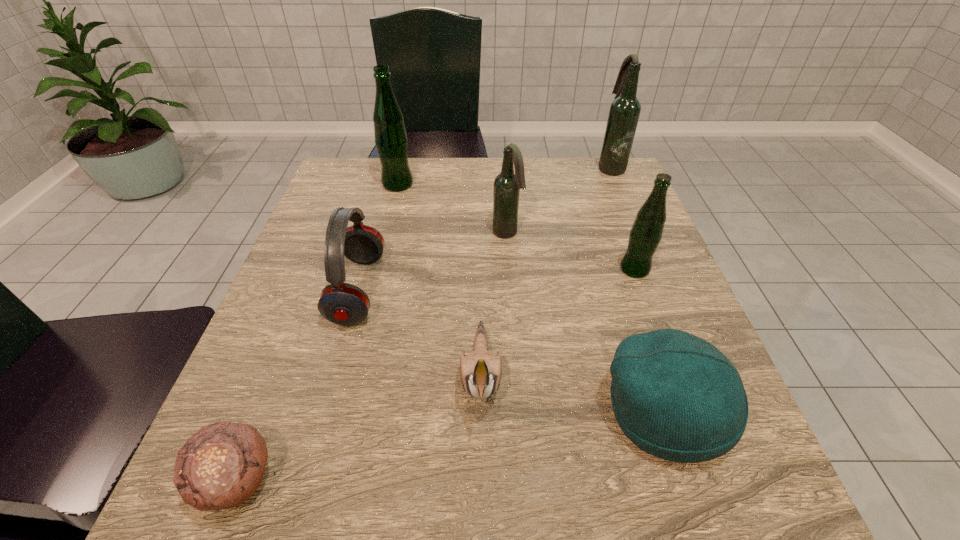
Where is `beanie that is at the near edge`? Image resolution: width=960 pixels, height=540 pixels. beanie that is at the near edge is located at coordinates (674, 395).

Identify the location of muffin that is at the near edge. The image size is (960, 540). (221, 466).

Find the location of a particular element. This screenshot has width=960, height=540. beer bottle located in the left edge section of the desktop is located at coordinates (391, 140).

Find the location of a particular element. Image resolution: width=960 pixels, height=540 pixels. earphone that is at the left edge is located at coordinates (341, 303).

Identify the location of muffin that is at the left edge. The height and width of the screenshot is (540, 960). (221, 466).

Locate an element on the screen. The height and width of the screenshot is (540, 960). beanie at the right edge is located at coordinates (674, 395).

The height and width of the screenshot is (540, 960). Identify the location of object present at the far left corner. (391, 140).

Locate an element on the screen. The image size is (960, 540). object that is positioned at the near left corner is located at coordinates (221, 466).

Identify the location of object situated at the far right corner. (624, 112).

You are a GUI agent. You are given a task and a screenshot of the screen. Output one action in this format:
    pyautogui.click(x=<x>, y=<y>)
    Task: Click on the object that is at the near right corner
    
    Given the screenshot: What is the action you would take?
    pyautogui.click(x=674, y=395)